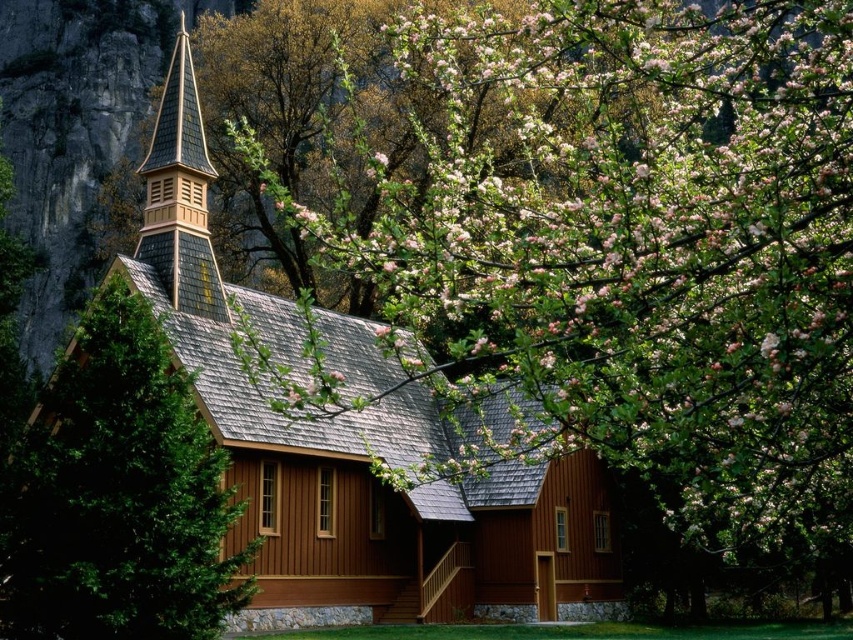
Which is in front, point (548, 605) or point (0, 502)?

Positioned in front is point (0, 502).

Looking at this image, is brown wooden church at center bigger than green textured pine tree at left?

Correct, brown wooden church at center is larger in size than green textured pine tree at left.

Identify the location of brown wooden church at center. The image size is (853, 640). (352, 452).

Which is below, green textured pine tree at left or shiny brown wood spire at upper left?

green textured pine tree at left is below.

The image size is (853, 640). I want to click on green textured pine tree at left, so click(117, 496).

Does point (27, 534) come farther from viewer compared to point (177, 285)?

No, it is in front of (177, 285).

At what (x,y) coordinates should I click in order to perform the action: click on green textured pine tree at left. Please return your answer as a coordinate pair (x, y). Looking at the image, I should click on (117, 496).

The width and height of the screenshot is (853, 640). What do you see at coordinates (352, 452) in the screenshot? I see `brown wooden church at center` at bounding box center [352, 452].

Which is above, brown wooden church at center or shiny brown wood spire at upper left?

Positioned higher is shiny brown wood spire at upper left.

Identify the location of brown wooden church at center. The height and width of the screenshot is (640, 853). (352, 452).